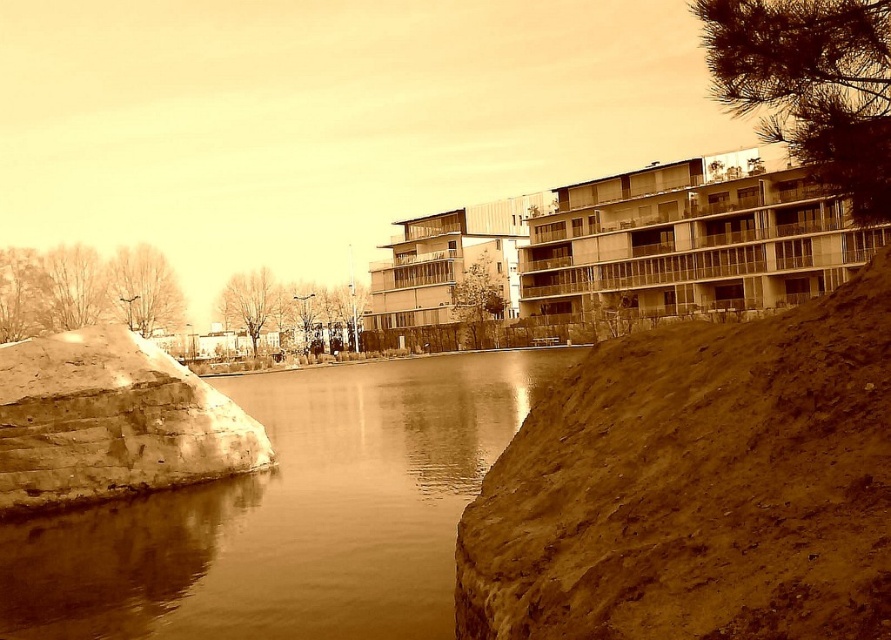
Question: Where is brown smooth water at center located in relation to matte concrete building at center in the image?

Choices:
 (A) above
 (B) below

Answer: (B)

Question: Which of these objects is positioned closest to the brown dirt embankment at right?

Choices:
 (A) brown smooth water at center
 (B) rustic stone wall at left

Answer: (A)

Question: Which point is closer to the camera taking this photo?

Choices:
 (A) (857, 436)
 (B) (279, 563)
 (C) (381, 280)
 (D) (123, 365)

Answer: (A)

Question: Which point is farther from the camera taking this photo?

Choices:
 (A) (701, 472)
 (B) (2, 554)
 (C) (46, 344)
 (D) (646, 180)

Answer: (D)

Question: Considering the relative positions of brown dirt embankment at right and rustic stone wall at left in the image provided, where is brown dirt embankment at right located with respect to rustic stone wall at left?

Choices:
 (A) left
 (B) right

Answer: (B)

Question: Can you confirm if brown dirt embankment at right is positioned below rustic stone wall at left?

Choices:
 (A) yes
 (B) no

Answer: (B)